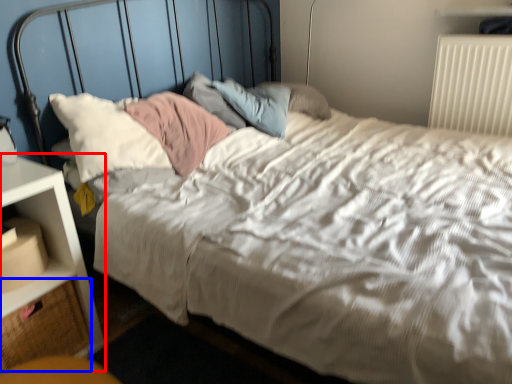
Question: Which of the following is the closest to the observer, nightstand (highlighted by a red box) or drawer (highlighted by a blue box)?

Choices:
 (A) nightstand
 (B) drawer

Answer: (A)